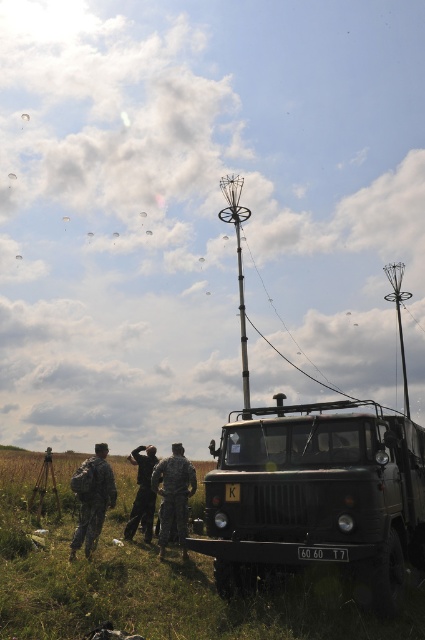
You are a photographer trying to capture a wide shot of the camouflage painted truck at center and the camouflage fabric uniform at center for a military magazine. Based on their sizes, which object would require more space in the frame to be fully visible?

The camouflage painted truck at center might be wider than camouflage fabric uniform at center, so it would require more space in the frame to be fully visible.

You are a photographer positioned at the scene. You want to take a photo that includes both the camouflage painted truck at center and the camouflage fabric uniform at lower left. Which object should you focus on first to ensure both are in sharp focus?

The camouflage painted truck at center is closer to the viewer than the camouflage fabric uniform at lower left. To ensure both are in sharp focus, focus on the camouflage painted truck at center first, as it is closer, and the uniform will be within the depth of field.